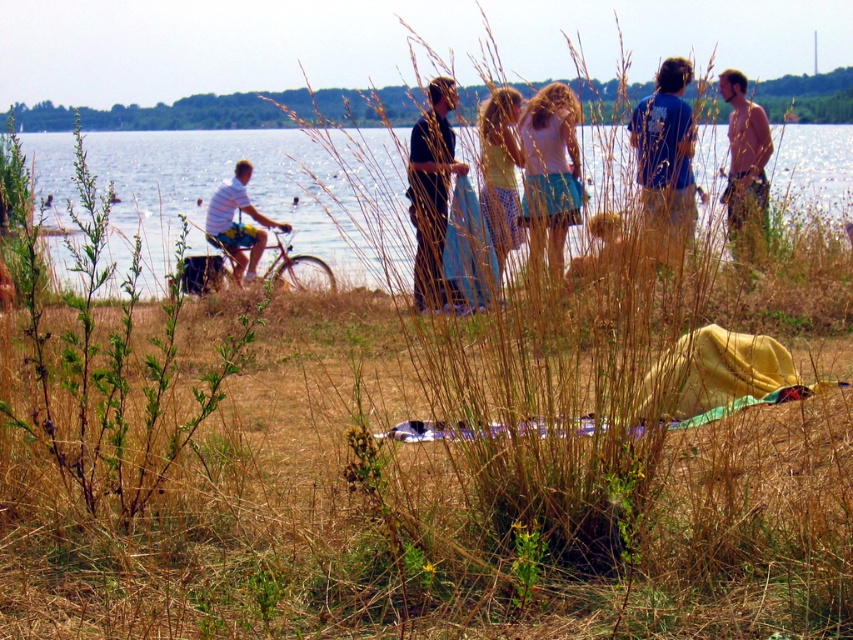
You are a photographer standing at the center of the scene. You want to take a photo of the shiny brown hair at right. Where should you point your camera?

You should point your camera towards the right side of the scene at point coordinates of (746, 168) to capture the shiny brown hair at right.

From the picture: You are standing at the point marked by coordinates point (746,168). You want to look towards the right. What is the first object you will see?

The first object you will see when looking to the right from point (746,168) is the shiny brown hair at right.